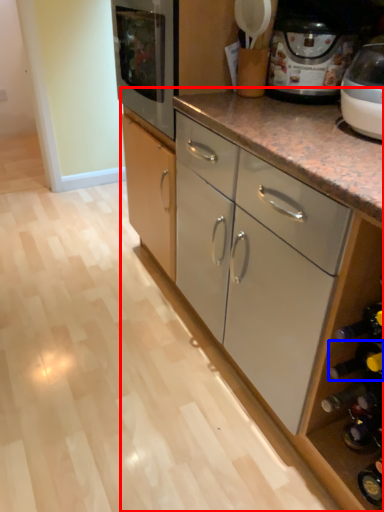
Question: Which of the following is the closest to the observer, cabinetry (highlighted by a red box) or wine bottle (highlighted by a blue box)?

Choices:
 (A) cabinetry
 (B) wine bottle

Answer: (B)